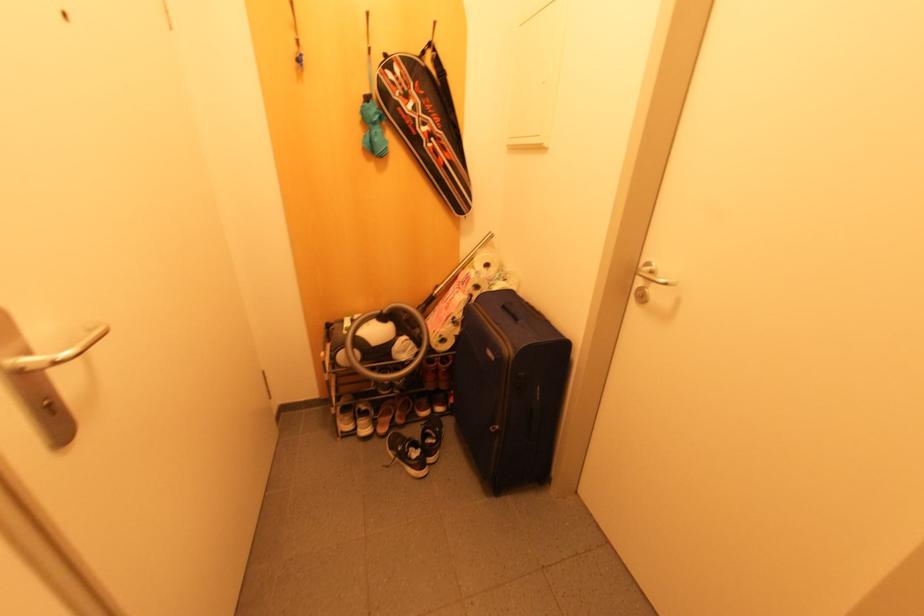
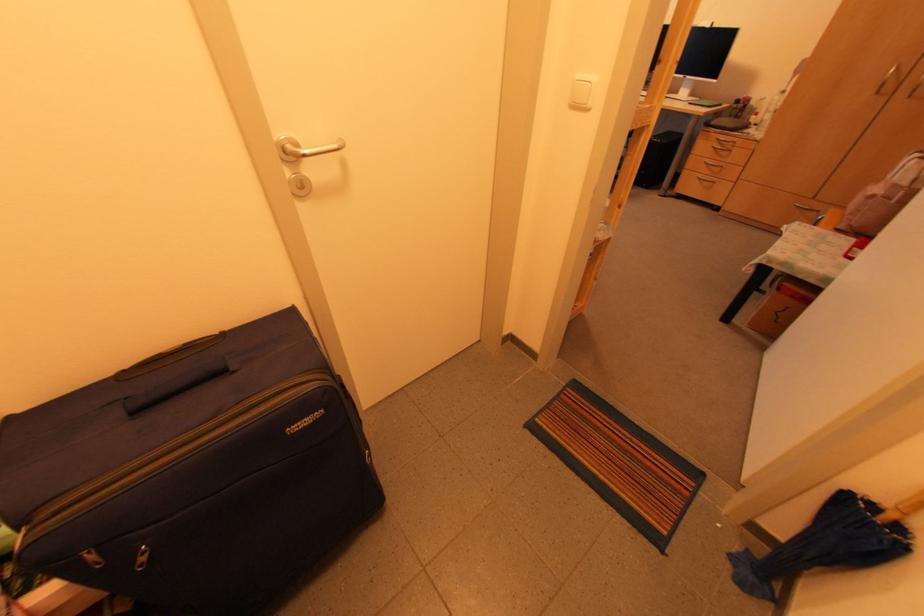
Based on the continuous images, in which direction is the camera rotating?

The camera's rotation is toward right-down.